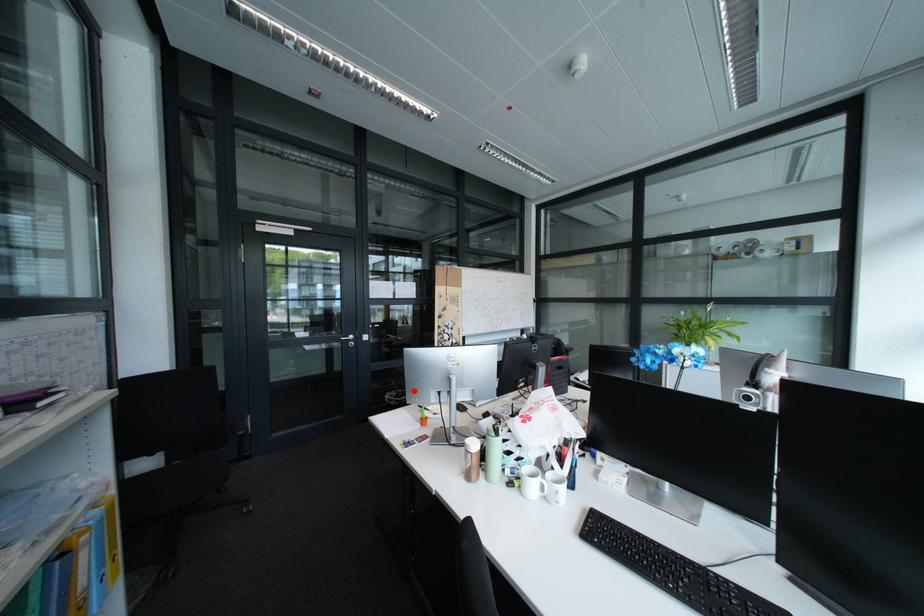
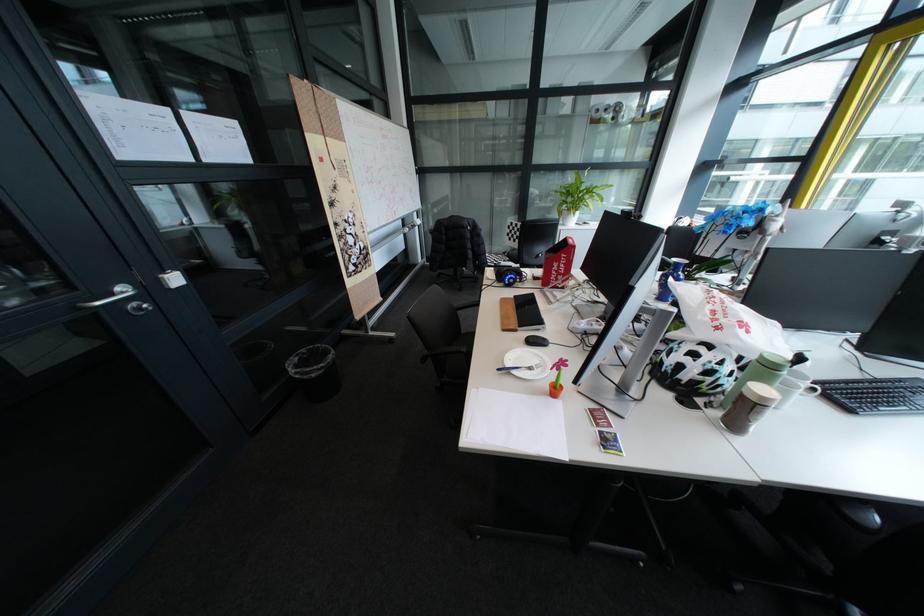
Question: I am providing you with two images of the same scene from different viewpoints. Given a red point in image1, look at the same physical point in image2. Is it:

Choices:
 (A) Closer to the viewpoint
 (B) Farther from the viewpoint

Answer: (A)